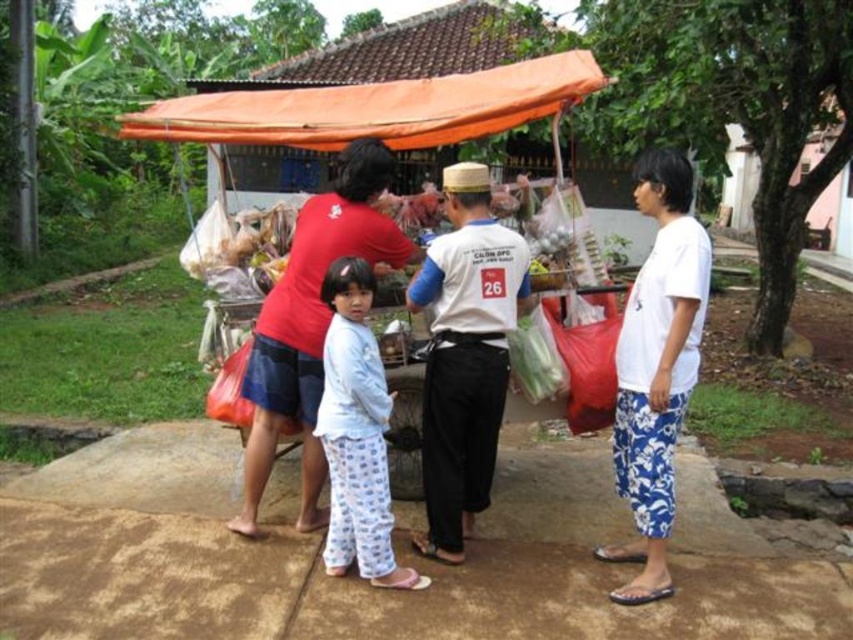
You are a visitor at this market and want to approach the vendor under the orange fabric canopy at upper center. There is a person wearing light blue pajama pants at center blocking your path. Which direction should you move to go around them?

Since the light blue pajama pants at center is to the right of the orange fabric canopy at upper center, you should move to the left to go around them and reach the vendor.

You are a drone operator trying to capture a photo of the matte red shirt at center. What are the coordinates you should aim for?

The coordinates for the matte red shirt at center are at point (311, 323).

Consider the image. You are a customer at the market stall. You notice the light blue pajama pants at center and the orange fabric canopy at upper center. Which object is smaller in size?

The light blue pajama pants at center is smaller in size compared to the orange fabric canopy at upper center.